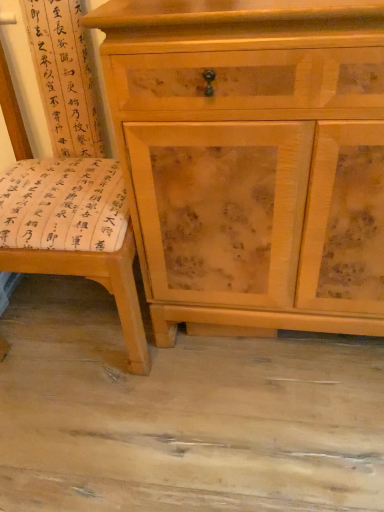
At what (x,y) coordinates should I click in order to perform the action: click on free space in front of wooden swivel chair at left. Please return your answer as a coordinate pair (x, y). The height and width of the screenshot is (512, 384). Looking at the image, I should click on (116, 440).